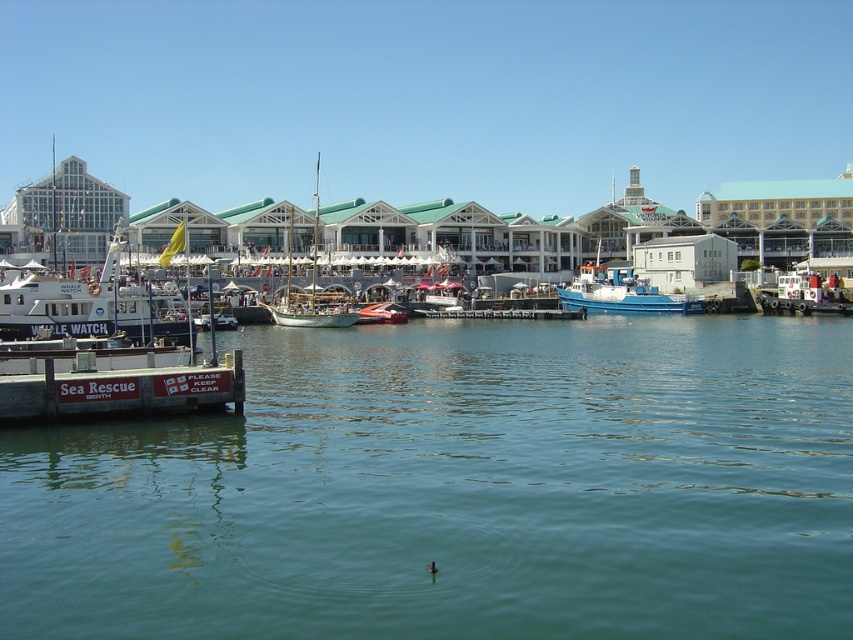
Question: Which is nearer to the wooden dock at lower left?

Choices:
 (A) green water at lower center
 (B) white matte boat at left

Answer: (A)

Question: Can you confirm if green water at lower center is positioned to the left of wooden dock at center?

Choices:
 (A) no
 (B) yes

Answer: (B)

Question: Is white matte boat at left bigger than wooden sailboat at center?

Choices:
 (A) no
 (B) yes

Answer: (B)

Question: Which of the following is the farthest from the observer?

Choices:
 (A) white matte boat at left
 (B) wooden dock at center

Answer: (B)

Question: Can you confirm if white matte boat at left is positioned below blue matte boat at center?

Choices:
 (A) no
 (B) yes

Answer: (A)

Question: Which point is farther to the camera?

Choices:
 (A) blue matte boat at center
 (B) wooden dock at lower left

Answer: (A)